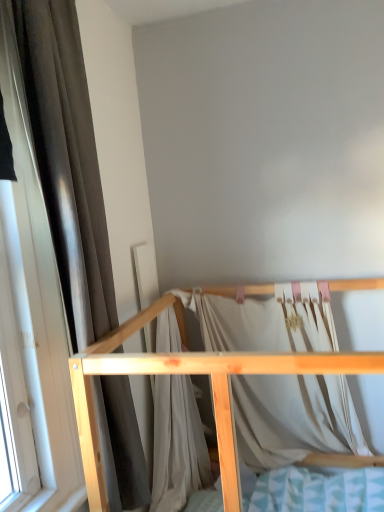
Question: Based on their sizes in the image, would you say natural wood bed frame at center is bigger or smaller than brown fabric curtain at left?

Choices:
 (A) small
 (B) big

Answer: (B)

Question: From the image's perspective, is natural wood bed frame at center above or below brown fabric curtain at left?

Choices:
 (A) below
 (B) above

Answer: (A)

Question: Is natural wood bed frame at center spatially inside brown fabric curtain at left, or outside of it?

Choices:
 (A) inside
 (B) outside

Answer: (B)

Question: In terms of width, does brown fabric curtain at left look wider or thinner when compared to natural wood bed frame at center?

Choices:
 (A) wide
 (B) thin

Answer: (B)

Question: Is point click(92, 206) closer or farther from the camera than point click(213, 408)?

Choices:
 (A) farther
 (B) closer

Answer: (A)

Question: Is brown fabric curtain at left in front of or behind natural wood bed frame at center in the image?

Choices:
 (A) front
 (B) behind

Answer: (B)

Question: From the image's perspective, is brown fabric curtain at left located above or below natural wood bed frame at center?

Choices:
 (A) below
 (B) above

Answer: (B)